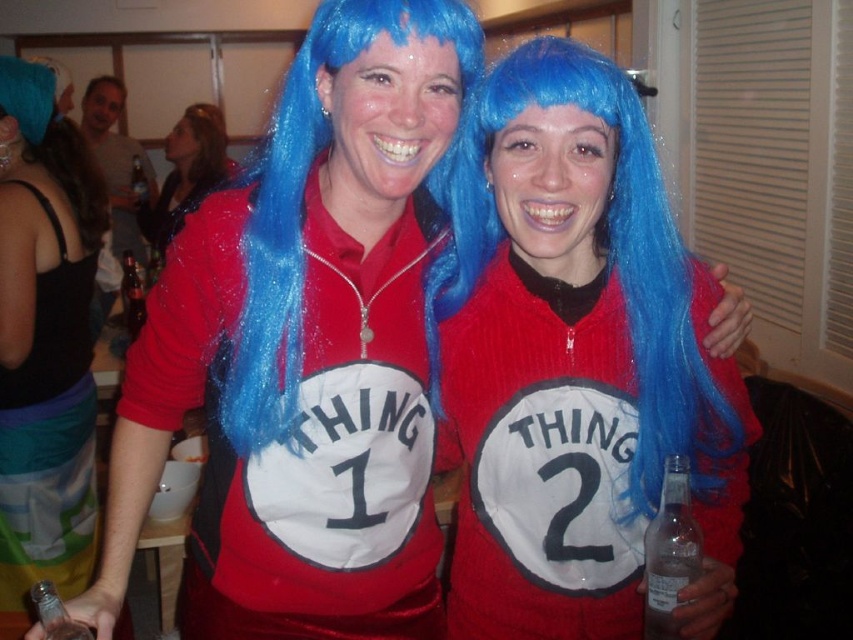
Can you confirm if clear glass bottle at lower right is smaller than matte plastic wig at upper center?

Yes, clear glass bottle at lower right is smaller than matte plastic wig at upper center.

Who is positioned more to the right, clear glass bottle at lower right or matte plastic wig at upper center?

clear glass bottle at lower right

Is point (663, 504) farther from viewer compared to point (189, 211)?

No.

Find the location of a particular element. This screenshot has width=853, height=640. clear glass bottle at lower right is located at coordinates (670, 552).

Can you confirm if black satin dress at left is bigger than blue synthetic wig at upper center?

Yes.

Which is in front, point (74, 422) or point (190, 106)?

Point (74, 422) is more forward.

Image resolution: width=853 pixels, height=640 pixels. I want to click on black satin dress at left, so click(x=45, y=339).

Does red glittery wig at center have a greater width compared to blue synthetic wig at upper left?

Correct, the width of red glittery wig at center exceeds that of blue synthetic wig at upper left.

Does red glittery wig at center have a smaller size compared to blue synthetic wig at upper left?

No, red glittery wig at center is not smaller than blue synthetic wig at upper left.

Between point (427, 428) and point (61, 140), which one is positioned behind?

Positioned behind is point (61, 140).

Find the location of `red glittery wig at center`. red glittery wig at center is located at coordinates (303, 432).